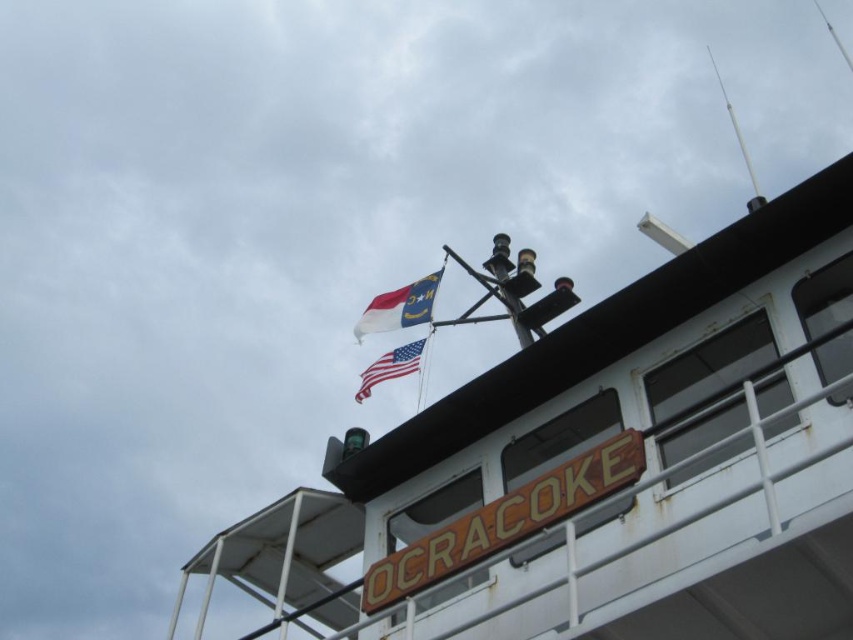
Question: Is white matte boat at upper center bigger than matte plastic flag at upper center?

Choices:
 (A) yes
 (B) no

Answer: (A)

Question: Observing the image, what is the correct spatial positioning of matte plastic flag at upper center in reference to american flag at upper center?

Choices:
 (A) above
 (B) below

Answer: (A)

Question: Is matte plastic flag at upper center smaller than american flag at upper center?

Choices:
 (A) yes
 (B) no

Answer: (B)

Question: Which point is farther to the camera?

Choices:
 (A) (401, 305)
 (B) (387, 355)

Answer: (A)

Question: Which object is closer to the camera taking this photo?

Choices:
 (A) american flag at upper center
 (B) white matte boat at upper center

Answer: (B)

Question: Which of the following is the closest to the observer?

Choices:
 (A) (404, 360)
 (B) (428, 317)
 (C) (564, 419)

Answer: (C)